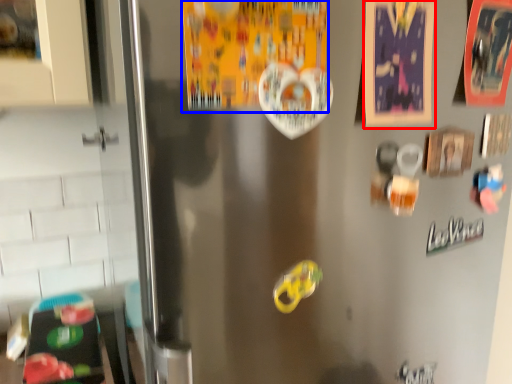
Question: Which object is closer to the camera taking this photo, postcard (highlighted by a red box) or postcard (highlighted by a blue box)?

Choices:
 (A) postcard
 (B) postcard

Answer: (B)